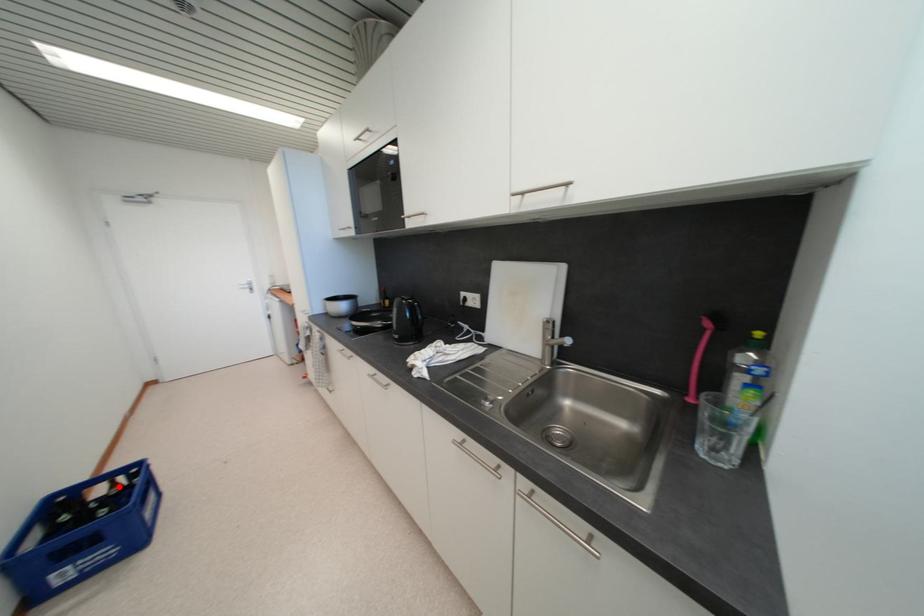
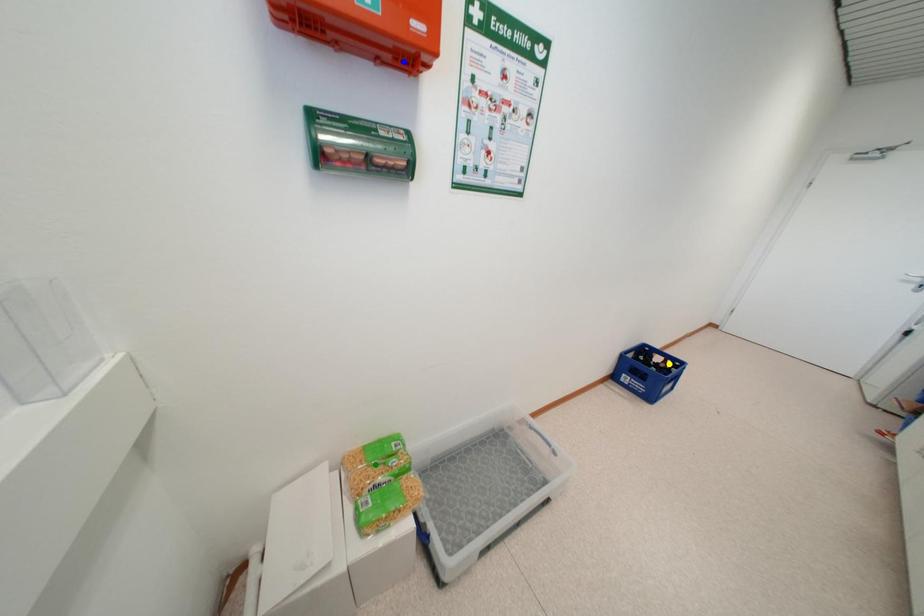
Question: I am providing you with two images of the same scene from different viewpoints. A red point is marked on the first image. You are given multiple points on the second image. Which point in image 2 is actually the same real-world point as the red point in image 1?

Choices:
 (A) green point
 (B) yellow point
 (C) blue point

Answer: (B)